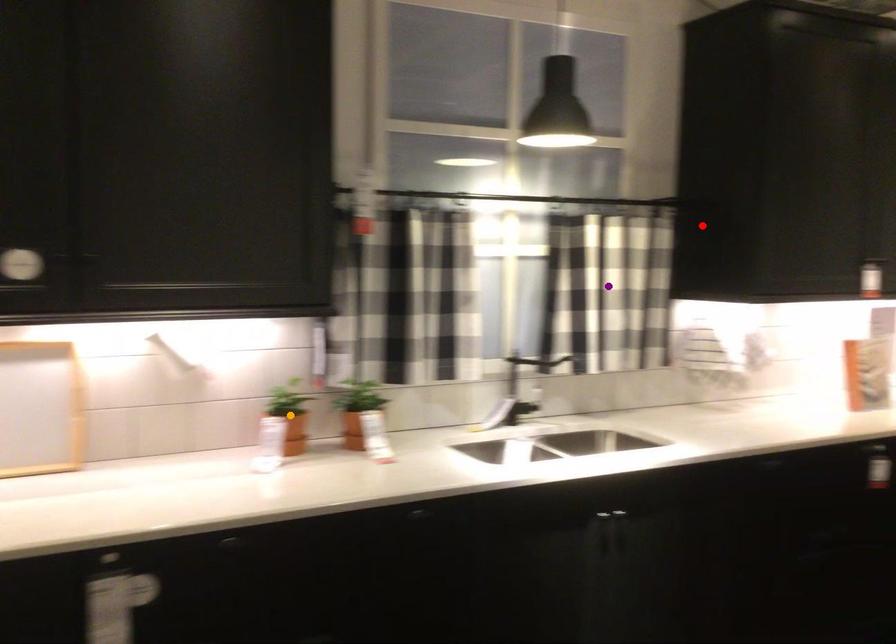
Order these from nearest to farthest:
A) purple point
B) orange point
C) red point

orange point
red point
purple point